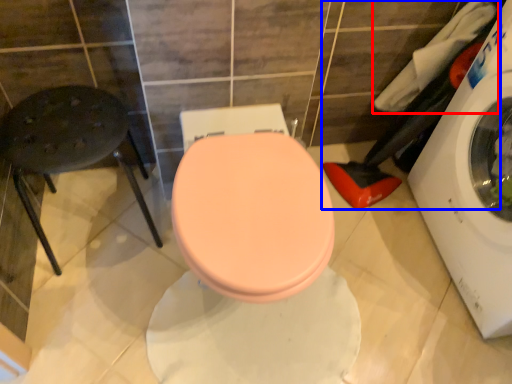
Question: Which point is closer to the camera, laundry (highlighted by a red box) or laundry (highlighted by a blue box)?

Choices:
 (A) laundry
 (B) laundry

Answer: (B)